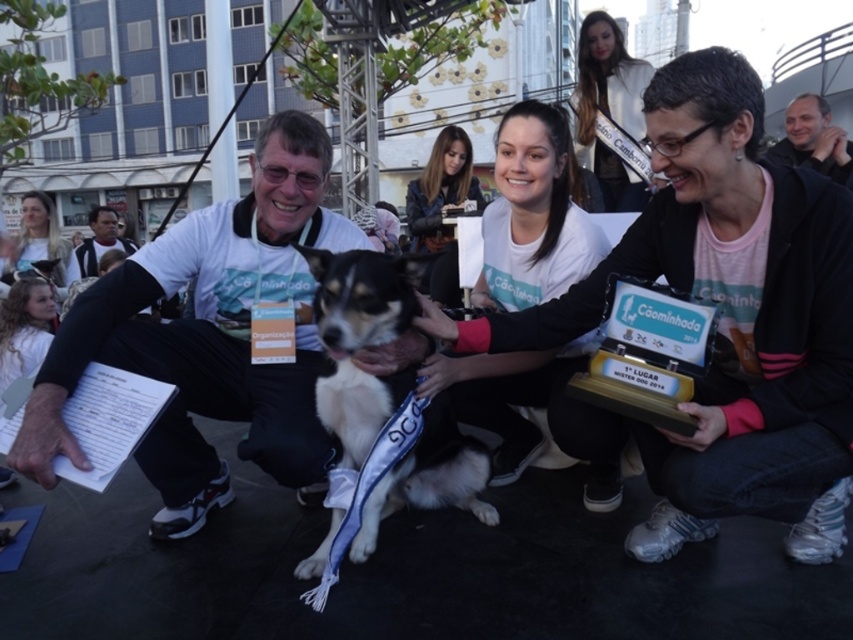
Does white satin sash at upper center have a smaller size compared to light brown hair at upper left?

Yes, white satin sash at upper center is smaller than light brown hair at upper left.

Does point (631, 120) come farther from viewer compared to point (20, 228)?

No, (631, 120) is closer to viewer.

Find the location of a particular element. The height and width of the screenshot is (640, 853). white satin sash at upper center is located at coordinates (608, 108).

Which is above, white fabric shirt at left or matte black shirt at center?

matte black shirt at center

From the picture: Which is more to the left, white fabric shirt at left or matte black shirt at center?

Positioned to the left is matte black shirt at center.

In order to click on white fabric shirt at left in this screenshot , I will do `click(210, 337)`.

Who is positioned more to the left, white matte shirt at center or light brown hair at upper left?

From the viewer's perspective, light brown hair at upper left appears more on the left side.

The height and width of the screenshot is (640, 853). I want to click on white matte shirt at center, so click(x=532, y=214).

Is point (618, 477) positioned before point (22, 211)?

Yes, point (618, 477) is closer to viewer.

Image resolution: width=853 pixels, height=640 pixels. Find the location of `white matte shirt at center`. white matte shirt at center is located at coordinates (532, 214).